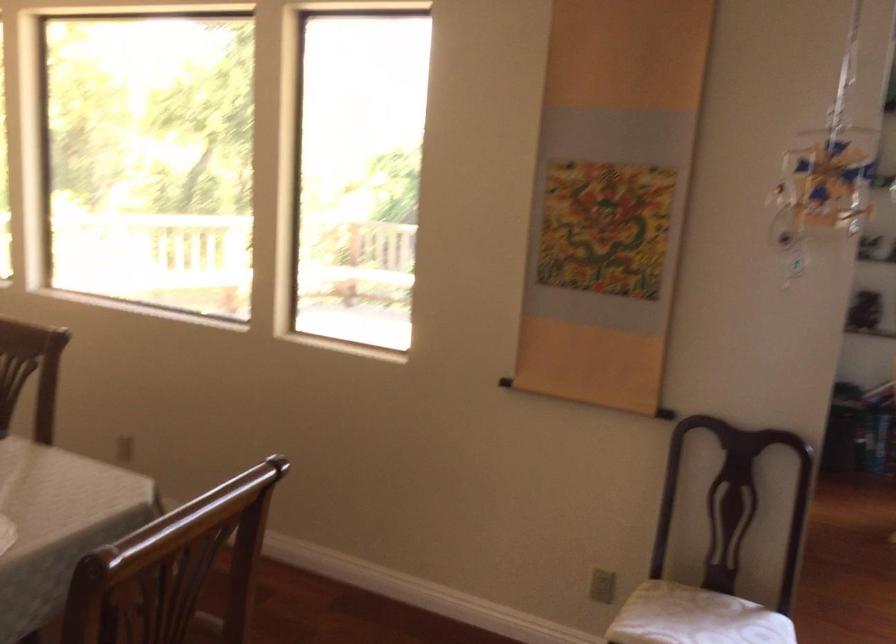
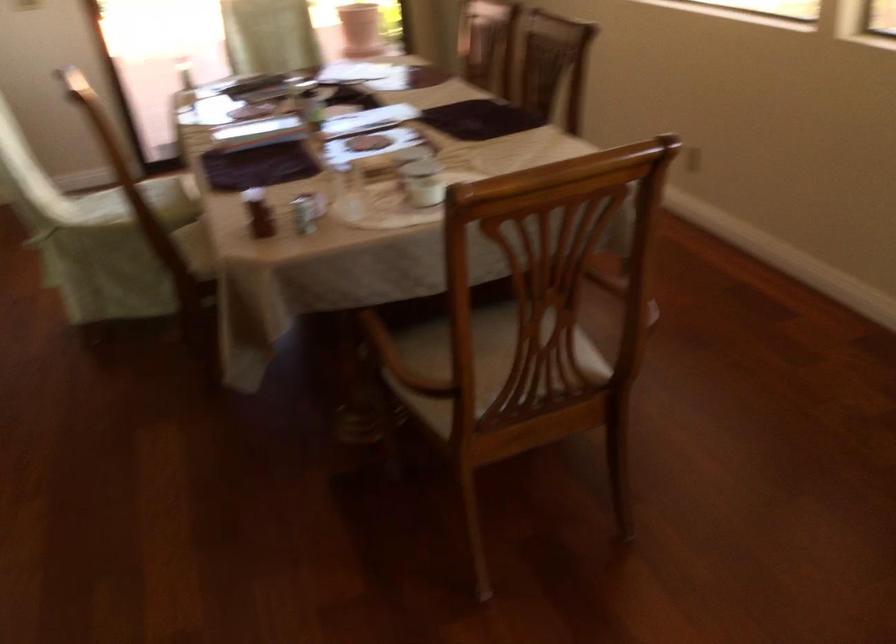
The first image is from the beginning of the video and the second image is from the end. How did the camera likely rotate when shooting the video?

The camera rotated toward left-down.